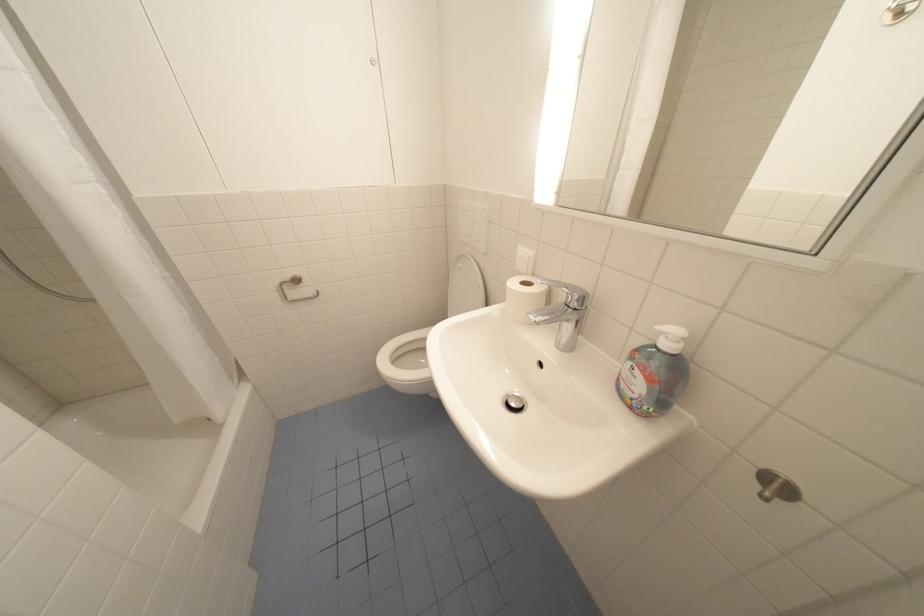
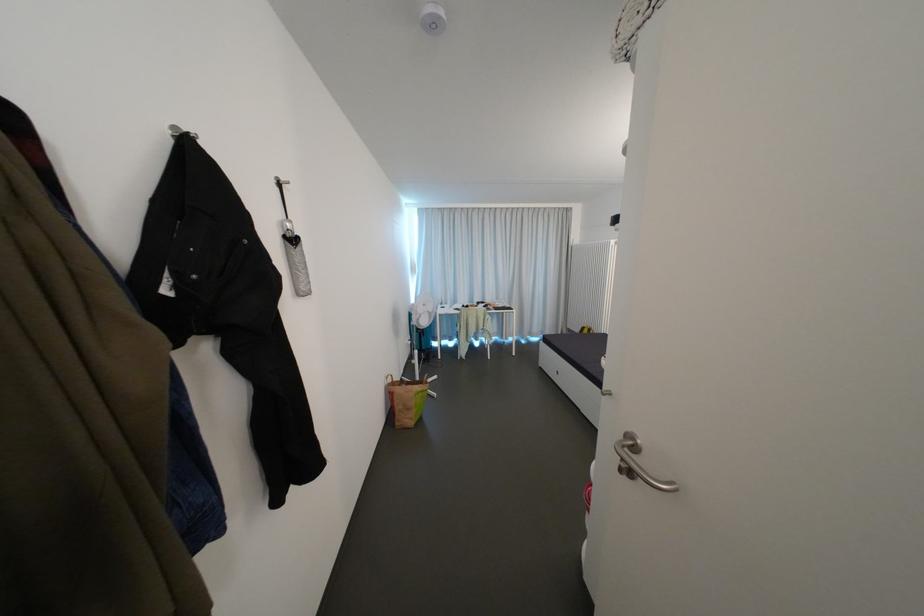
The images are taken continuously from a first-person perspective. In which direction is your viewpoint rotating?

The rotation direction of the camera is left-down.